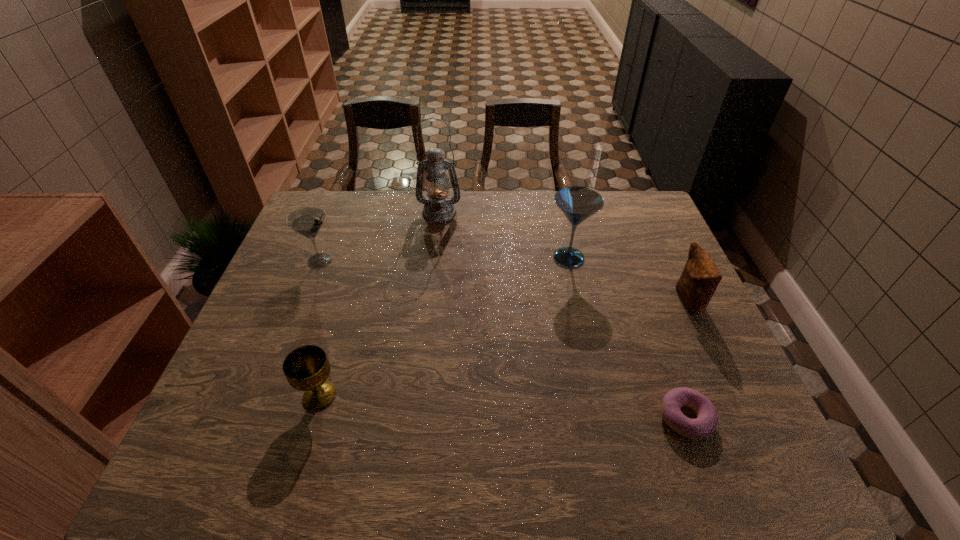
Locate an element on the screen. Image resolution: width=960 pixels, height=540 pixels. object that is the fifth nearest to the rightmost object is located at coordinates (308, 221).

Identify which object is located as the nearest to the left martini. Please provide its 2D coordinates. Your answer should be formatted as a tuple, i.e. [(x, y)], where the tuple contains the x and y coordinates of a point satisfying the conditions above.

[(438, 208)]

You are a GUI agent. You are given a task and a screenshot of the screen. Output one action in this format:
    pyautogui.click(x=<x>, y=<y>)
    Task: Click on the vacant space that satisfies the following two spatial constraints: 1. on the front side of the chalice; 2. on the right side of the shortest object
    This screenshot has width=960, height=540.
    Given the screenshot: What is the action you would take?
    pyautogui.click(x=313, y=418)

You are a GUI agent. You are given a task and a screenshot of the screen. Output one action in this format:
    pyautogui.click(x=<x>, y=<y>)
    Task: Click on the vacant area that satisfies the following two spatial constraints: 1. on the front side of the left martini; 2. on the left side of the chalice
    The width and height of the screenshot is (960, 540).
    Given the screenshot: What is the action you would take?
    (268, 396)